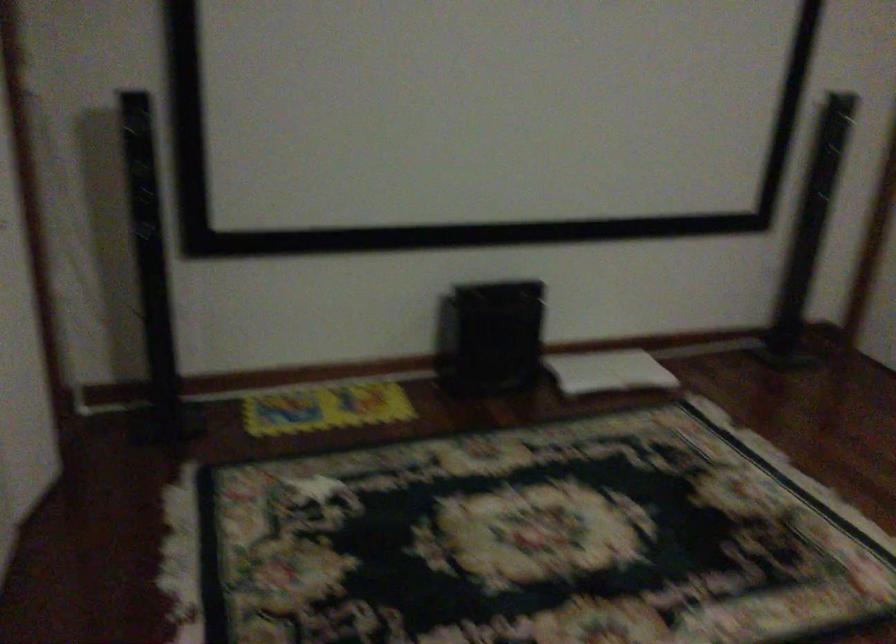
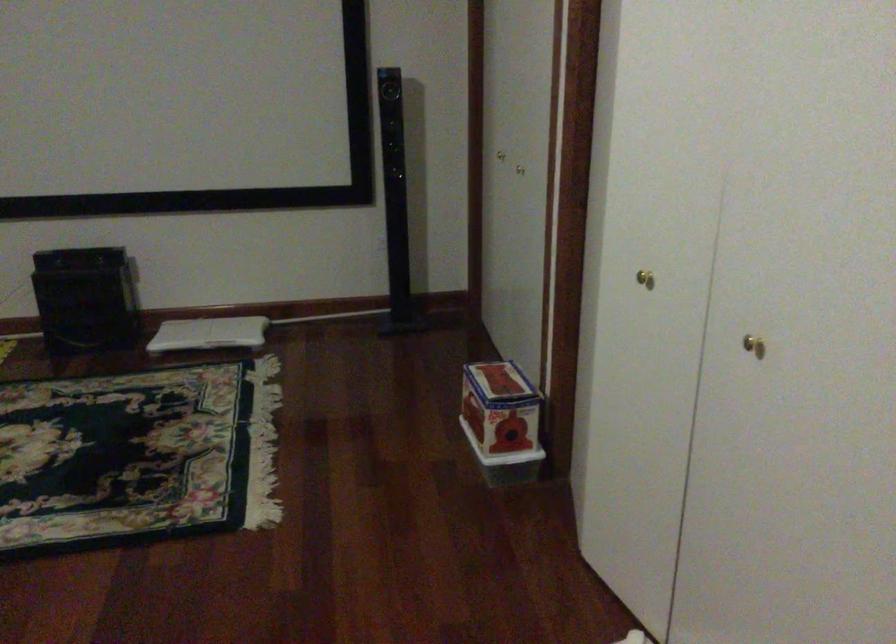
Find the pixel in the second image that matches pixel 631 371 in the first image.

(209, 333)